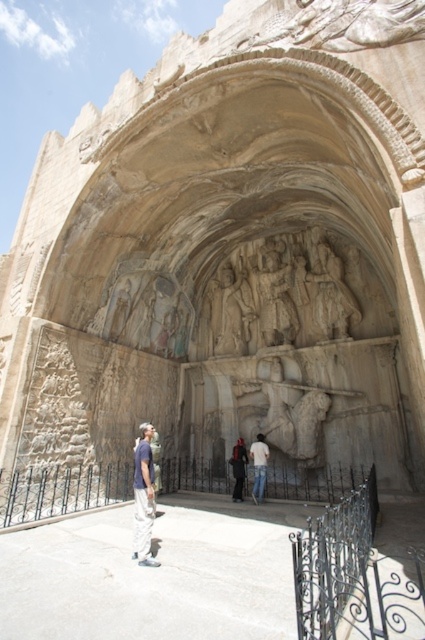
You are an architect analyzing the symmetry of the historical stone structure. The structure has a central axis running vertically through its center. Where are the carved stone figures at center located in relation to this central axis?

The carved stone figures at center are located at coordinates point (229, 310), which is very close to the central axis of the structure, indicating they are nearly centered.

You are standing in front of the historical stone structure and want to touch both the carved stone figures at center and the dark blue jeans at center. Which object should you reach for first, the one closer to you?

The carved stone figures at center is closer to you than the dark blue jeans at center, so you should reach for the carved stone figures at center first.